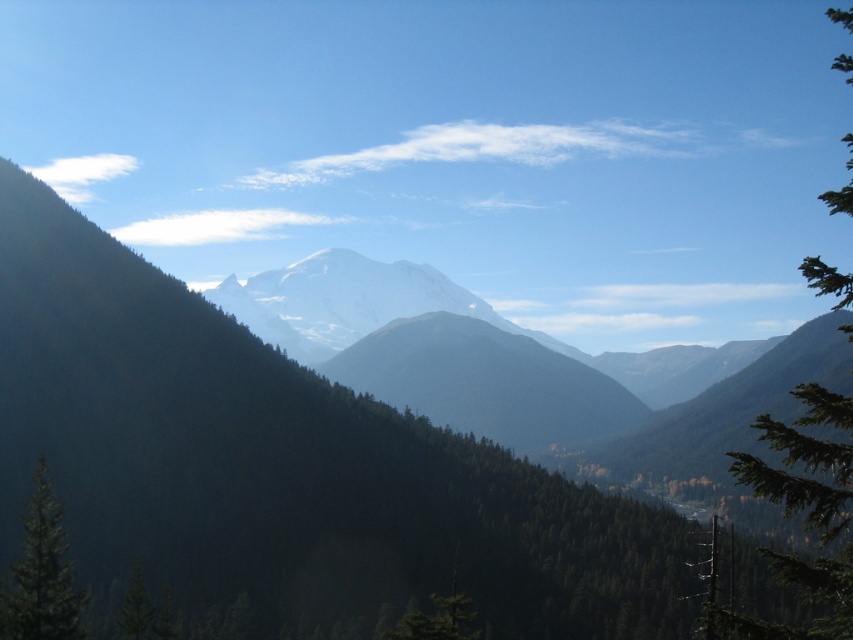
Question: Does green textured tree at right lie behind green textured tree at lower left?

Choices:
 (A) no
 (B) yes

Answer: (A)

Question: Which of the following is the closest to the observer?

Choices:
 (A) (26, 604)
 (B) (811, 563)

Answer: (B)

Question: Does green textured tree at right appear on the left side of green textured tree at lower left?

Choices:
 (A) no
 (B) yes

Answer: (A)

Question: Can you confirm if green textured tree at right is positioned below green textured tree at lower left?

Choices:
 (A) yes
 (B) no

Answer: (B)

Question: Which point is closer to the camera?

Choices:
 (A) green textured tree at right
 (B) green textured tree at lower left

Answer: (A)

Question: Which of the following is the farthest from the observer?

Choices:
 (A) (30, 630)
 (B) (838, 209)

Answer: (A)